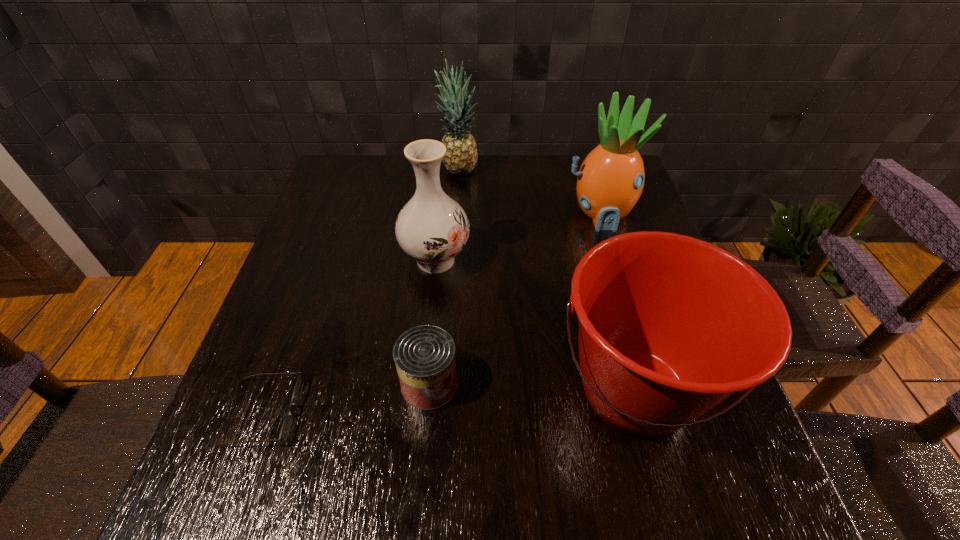
The height and width of the screenshot is (540, 960). I want to click on the farther pineapple, so click(461, 155).

You are a GUI agent. You are given a task and a screenshot of the screen. Output one action in this format:
    pyautogui.click(x=<x>, y=<y>)
    Task: Click on the left pineapple
    The image size is (960, 540).
    Given the screenshot: What is the action you would take?
    pyautogui.click(x=461, y=155)

Locate an element on the screen. This screenshot has width=960, height=540. the right pineapple is located at coordinates (610, 181).

Locate an element on the screen. This screenshot has width=960, height=540. the nearer pineapple is located at coordinates (610, 181).

Where is `vase`? The height and width of the screenshot is (540, 960). vase is located at coordinates (432, 228).

Where is `bucket`? This screenshot has height=540, width=960. bucket is located at coordinates (670, 326).

Identify the location of can. Image resolution: width=960 pixels, height=540 pixels. (x=424, y=355).

At what (x,y) coordinates should I click in order to perform the action: click on spectacles. Please return your answer as a coordinate pair (x, y). Looking at the image, I should click on 287,422.

Locate an element on the screen. The width and height of the screenshot is (960, 540). the shortest object is located at coordinates (287, 422).

This screenshot has height=540, width=960. I want to click on vacant space located on the right of the farthest object, so (555, 170).